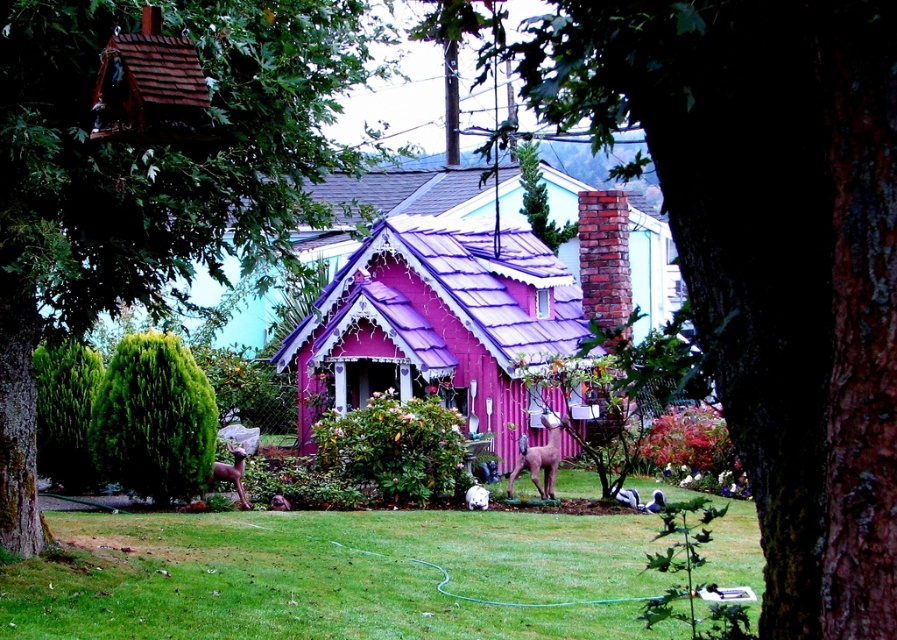
Question: Which of these objects is positioned farthest from the pink corrugated metal hut at center?

Choices:
 (A) green leafy tree at center
 (B) brown matte statue at lower center
 (C) green textured bush at lower left

Answer: (C)

Question: Which object is closer to the camera taking this photo?

Choices:
 (A) green leafy tree at center
 (B) green textured bush at lower left
 (C) brown matte statue at lower center
 (D) purple matte tree at center

Answer: (D)

Question: Is pink corrugated metal hut at center below pink matte statue at center?

Choices:
 (A) no
 (B) yes

Answer: (A)

Question: Does pink corrugated metal hut at center have a lesser width compared to green textured bush at lower left?

Choices:
 (A) no
 (B) yes

Answer: (A)

Question: Considering the relative positions of green textured bush at lower left and pink matte statue at center in the image provided, where is green textured bush at lower left located with respect to pink matte statue at center?

Choices:
 (A) below
 (B) above

Answer: (B)

Question: Which is nearer to the pink corrugated metal hut at center?

Choices:
 (A) pink matte statue at center
 (B) brown matte statue at lower center
 (C) green textured bush at lower left

Answer: (B)